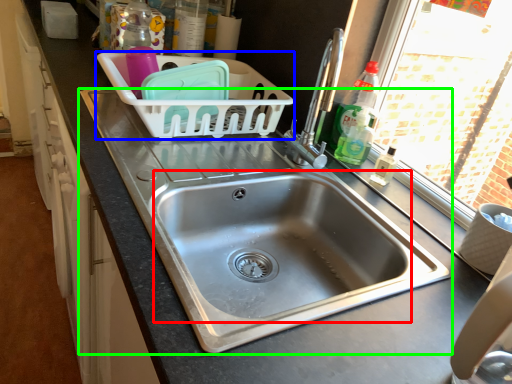
Question: Estimate the real-world distances between objects in this image. Which object is closer to sink (highlighted by a red box), basket (highlighted by a blue box) or sink (highlighted by a green box)?

Choices:
 (A) basket
 (B) sink

Answer: (B)